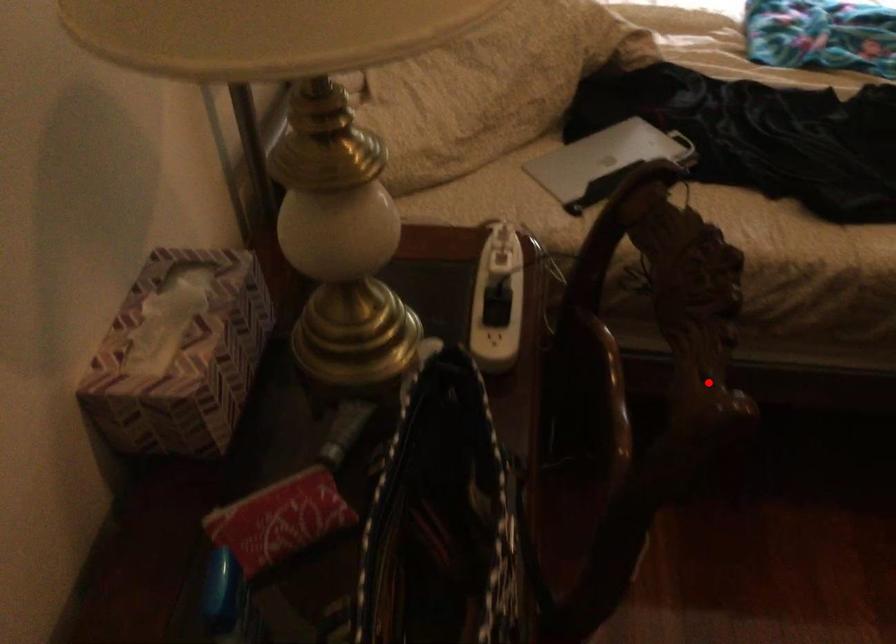
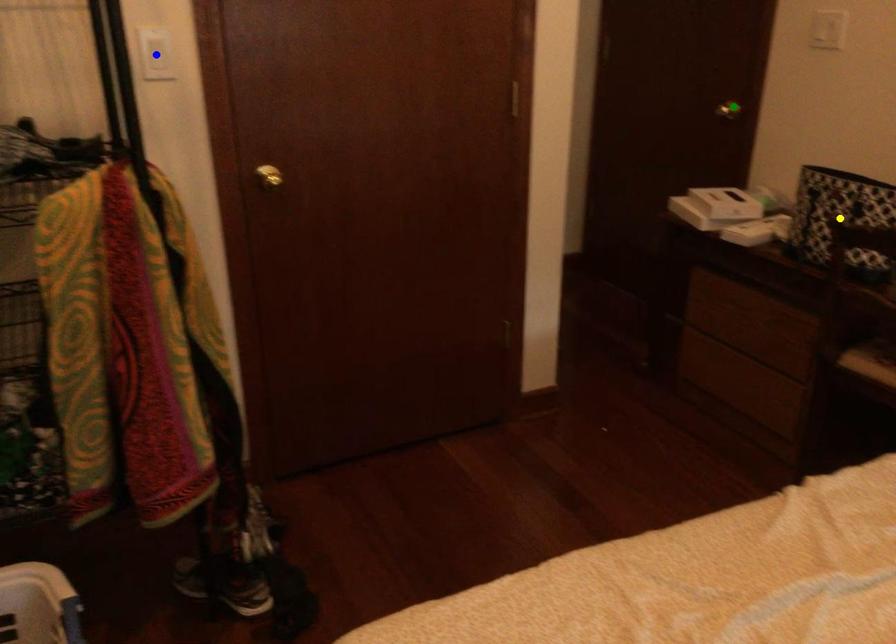
Question: I am providing you with two images of the same scene from different viewpoints. A red point is marked on the first image. You are given multiple points on the second image. Which point in image 2 is actually the same real-world point as the red point in image 1?

Choices:
 (A) blue point
 (B) yellow point
 (C) green point

Answer: (B)